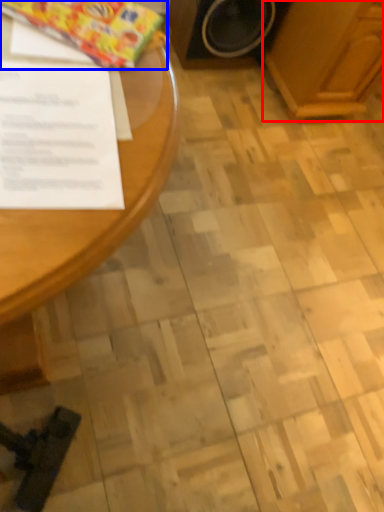
Question: Which object is further to the camera taking this photo, wood (highlighted by a red box) or wrapping paper (highlighted by a blue box)?

Choices:
 (A) wood
 (B) wrapping paper

Answer: (A)